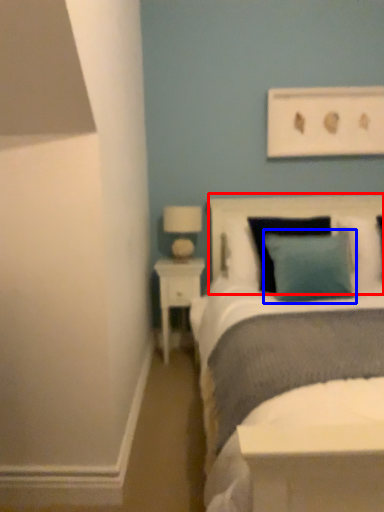
Question: Among these objects, which one is nearest to the camera, headboard (highlighted by a red box) or pillow (highlighted by a blue box)?

Choices:
 (A) headboard
 (B) pillow

Answer: (B)